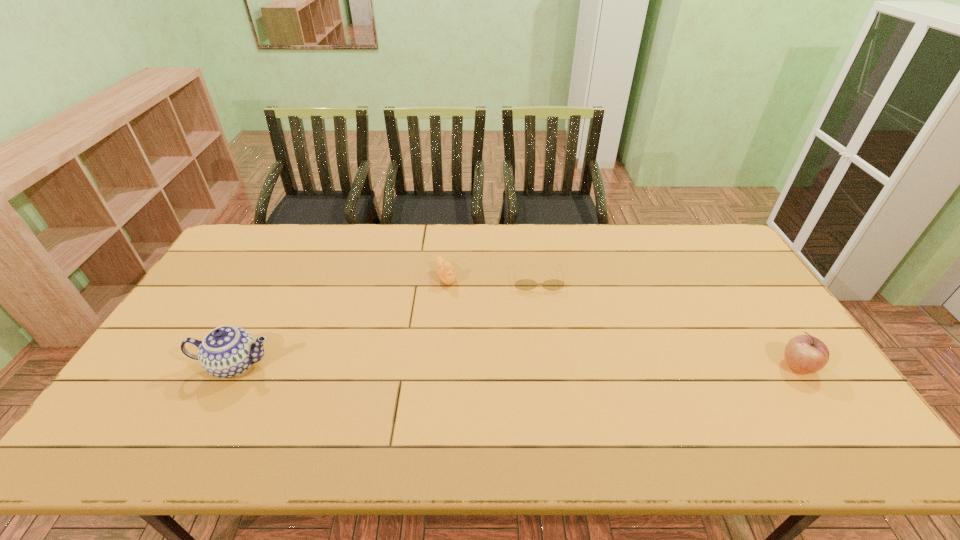
The height and width of the screenshot is (540, 960). What are the coordinates of `empty space between the tallest object and the shortest object` in the screenshot? It's located at (387, 322).

Where is `empty space that is in between the rightmost object and the tallest object`? empty space that is in between the rightmost object and the tallest object is located at coordinates pyautogui.click(x=517, y=366).

The height and width of the screenshot is (540, 960). In order to click on free spot between the third object from left to right and the second tallest object in this screenshot , I will do `click(667, 322)`.

Where is `vacant space in between the rightmost object and the third tallest object`? vacant space in between the rightmost object and the third tallest object is located at coordinates (622, 322).

At what (x,y) coordinates should I click in order to perform the action: click on free space between the second shortest object and the sunglasses. Please return your answer as a coordinate pair (x, y). The width and height of the screenshot is (960, 540). Looking at the image, I should click on (492, 278).

Find the location of a particular element. This screenshot has width=960, height=540. vacant area between the second object from right to left and the chinaware is located at coordinates (387, 322).

Where is `vacant area that lies between the shortest object and the third object from right to left`? The height and width of the screenshot is (540, 960). vacant area that lies between the shortest object and the third object from right to left is located at coordinates (492, 278).

At what (x,y) coordinates should I click in order to perform the action: click on free space between the chinaware and the second object from left to right. Please return your answer as a coordinate pair (x, y). Looking at the image, I should click on (341, 321).

At what (x,y) coordinates should I click in order to perform the action: click on free space between the third object from right to left and the chinaware. Please return your answer as a coordinate pair (x, y). Looking at the image, I should click on (341, 321).

Where is `unoccupied position between the tallest object and the rightmost object`? This screenshot has height=540, width=960. unoccupied position between the tallest object and the rightmost object is located at coordinates (517, 366).